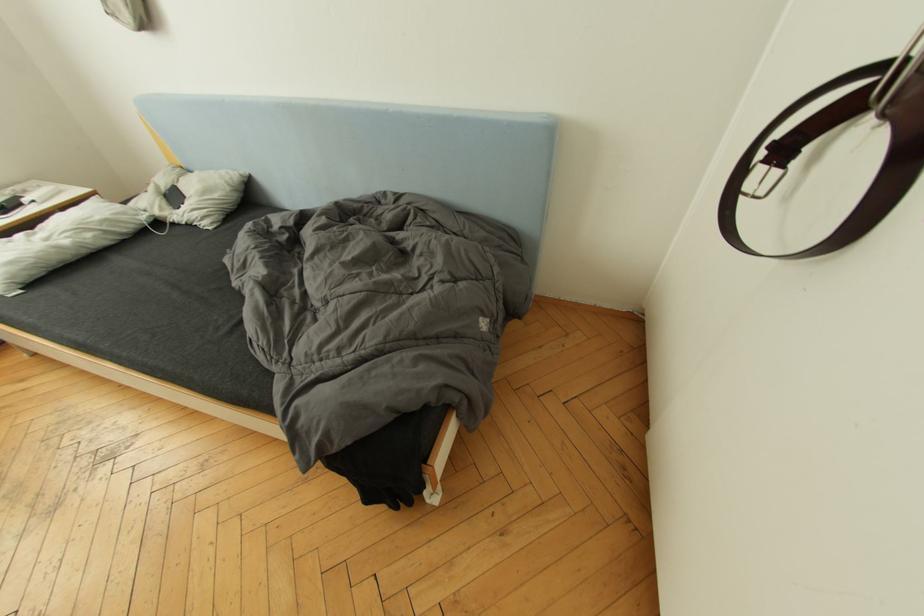
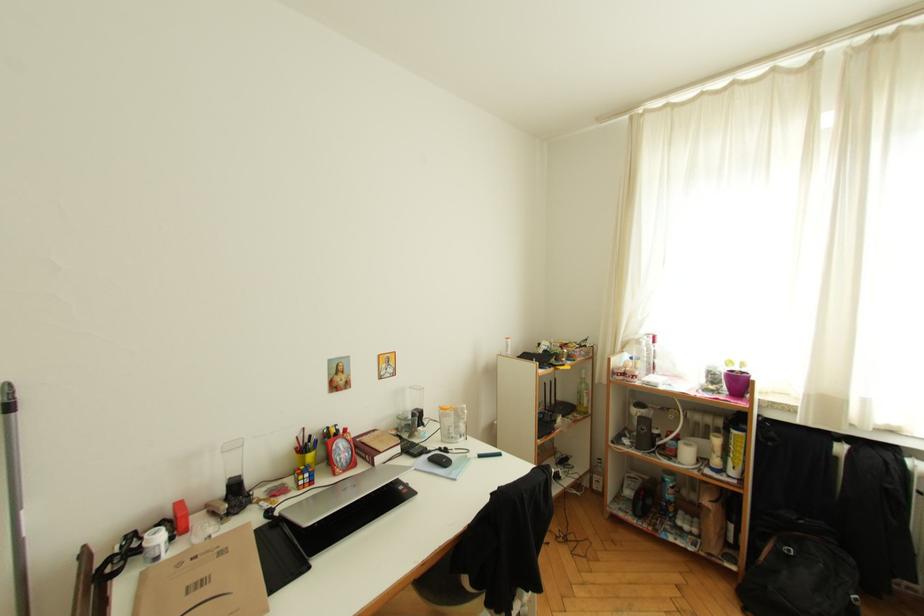
First-person continuous shooting, in which direction is the camera rotating?

The camera's rotation is toward left-down.